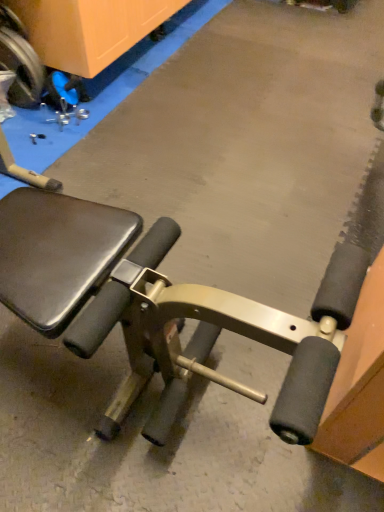
Measure the distance between point (1, 56) and camera.

Point (1, 56) is 6.09 feet from camera.

This screenshot has height=512, width=384. Describe the element at coordinates (21, 69) in the screenshot. I see `metallic blue wheel at upper left` at that location.

Where is `metallic blue wheel at upper left`? metallic blue wheel at upper left is located at coordinates (21, 69).

Locate an element on the screen. metallic blue wheel at upper left is located at coordinates (x=21, y=69).